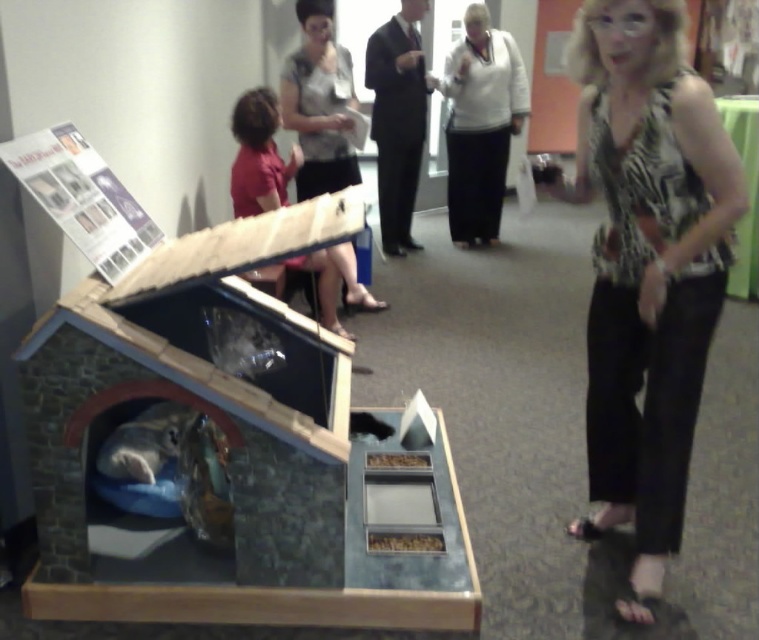
You are standing in front of the animal shelter model and want to place two markers at the coordinates point (685, 164) and point (518, 113). Which marker will be placed closer to you?

The marker at point (685, 164) will be closer to you because it is closer to the viewer than point (518, 113).

You are a fashion designer attending a clothing showcase. You notice two blouses in the image. The first is a zebra print blouse at center, and the second is a matte gray blouse at upper center. From your vantage point, which blouse appears to be positioned lower in the image?

The zebra print blouse at center is positioned below the matte gray blouse at upper center, so the zebra print blouse at center appears lower in the image.